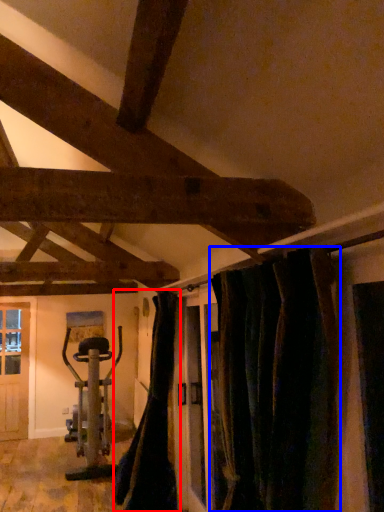
Question: Which point is further to the camera, curtain (highlighted by a red box) or curtain (highlighted by a blue box)?

Choices:
 (A) curtain
 (B) curtain

Answer: (A)